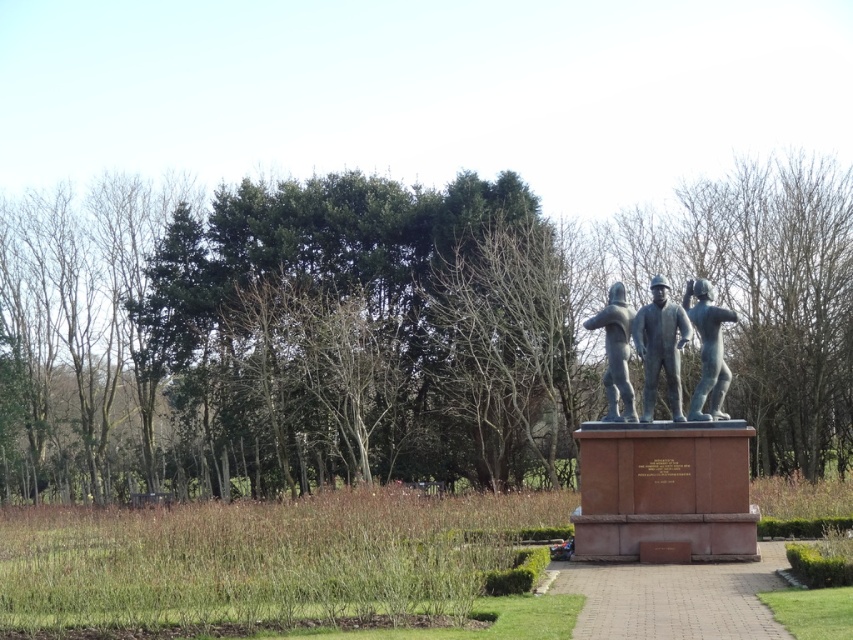
Question: Considering the relative positions of green leafy tree at center and bronze statue at center in the image provided, where is green leafy tree at center located with respect to bronze statue at center?

Choices:
 (A) left
 (B) right

Answer: (A)

Question: Can you confirm if green leafy tree at center is positioned below bronze statue at center?

Choices:
 (A) no
 (B) yes

Answer: (B)

Question: Which object appears closest to the camera in this image?

Choices:
 (A) green leafy tree at center
 (B) brick paved path at center
 (C) polished silver statue at center

Answer: (B)

Question: Considering the real-world distances, which object is closest to the bronze statue at center?

Choices:
 (A) green leafy tree at center
 (B) polished bronze statue at center
 (C) brick paved path at center
 (D) bronze statue at right

Answer: (B)

Question: Which point is closer to the camera?

Choices:
 (A) polished bronze statue at center
 (B) bronze statue at right

Answer: (A)

Question: Is the position of green leafy tree at center more distant than that of bronze statue at right?

Choices:
 (A) yes
 (B) no

Answer: (B)